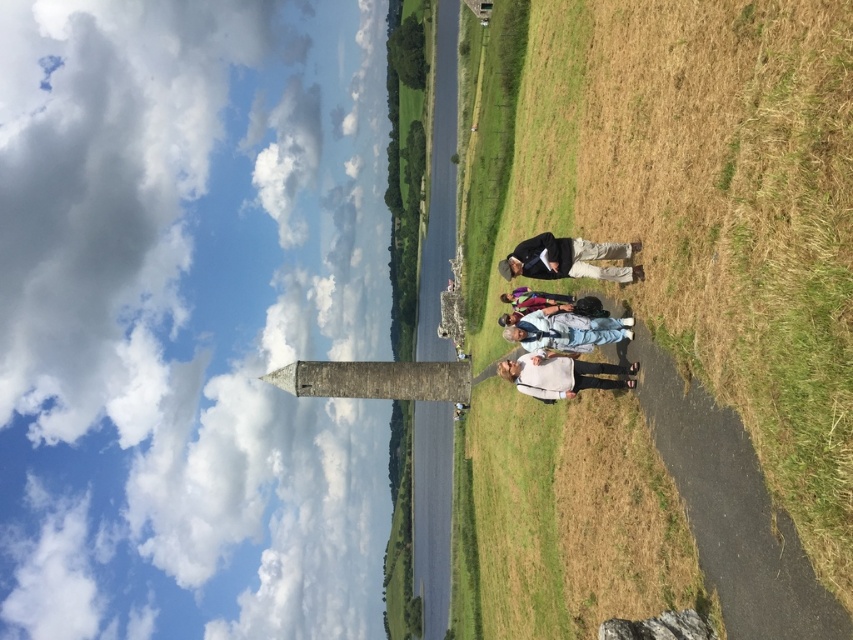
Question: Among these objects, which one is nearest to the camera?

Choices:
 (A) light blue denim jeans at center
 (B) dark gray jacket at center
 (C) dry grass at center

Answer: (C)

Question: Can you confirm if dry grass at center is smaller than dark gray jacket at center?

Choices:
 (A) no
 (B) yes

Answer: (A)

Question: Does dark gray jacket at center appear on the right side of light blue denim jeans at center?

Choices:
 (A) no
 (B) yes

Answer: (B)

Question: Where is light beige sweater at center located in relation to light blue denim jeans at center in the image?

Choices:
 (A) right
 (B) left

Answer: (A)

Question: Which object appears closest to the camera in this image?

Choices:
 (A) dry grass at center
 (B) dark gray jacket at center

Answer: (A)

Question: Which is farther from the dark gray jacket at center?

Choices:
 (A) dry grass at center
 (B) light beige sweater at center

Answer: (A)